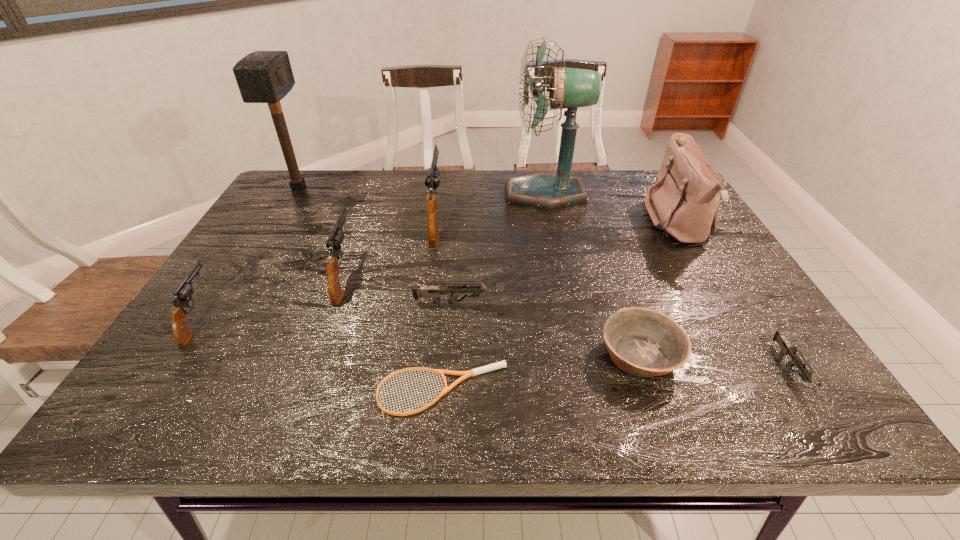
In the image, there is a desktop. Find the location of `free space at the near edge`. free space at the near edge is located at coordinates (744, 414).

Where is `vacant space at the left edge of the desktop`? The width and height of the screenshot is (960, 540). vacant space at the left edge of the desktop is located at coordinates (305, 235).

Image resolution: width=960 pixels, height=540 pixels. I want to click on vacant space at the right edge of the desktop, so click(x=772, y=332).

Identify the location of free space at the far left corner. (300, 170).

The height and width of the screenshot is (540, 960). What are the coordinates of `free space at the near left corner of the desktop` in the screenshot? It's located at (159, 396).

Find the location of a particular element. The height and width of the screenshot is (540, 960). vacant space in between the mallet and the leftmost black gun is located at coordinates (249, 253).

The height and width of the screenshot is (540, 960). What are the coordinates of `free space between the fourth tallest gun and the blue fan` in the screenshot? It's located at (503, 248).

Locate an element on the screen. This screenshot has height=540, width=960. free space between the mallet and the sixth shortest object is located at coordinates (322, 231).

Identify the location of free space between the bowl and the mallet. Image resolution: width=960 pixels, height=540 pixels. (469, 271).

The width and height of the screenshot is (960, 540). Identify the location of vacant region between the fan and the shoulder bag. (612, 209).